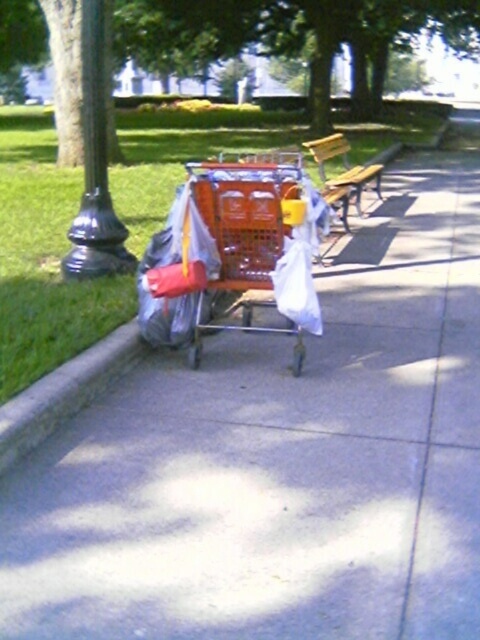
Question: Does orange plastic shopping cart at center appear on the left side of wooden bench at center?

Choices:
 (A) yes
 (B) no

Answer: (A)

Question: Which of the following is the farthest from the observer?

Choices:
 (A) (273, 214)
 (B) (345, 168)

Answer: (B)

Question: Does orange plastic shopping cart at center lie in front of wooden bench at center?

Choices:
 (A) yes
 (B) no

Answer: (A)

Question: Does orange plastic shopping cart at center appear under wooden bench at center?

Choices:
 (A) no
 (B) yes

Answer: (B)

Question: Which point is farther to the camera?

Choices:
 (A) (276, 188)
 (B) (370, 179)

Answer: (B)

Question: Which object appears closest to the camera in this image?

Choices:
 (A) orange plastic shopping cart at center
 (B) wooden bench at center

Answer: (A)